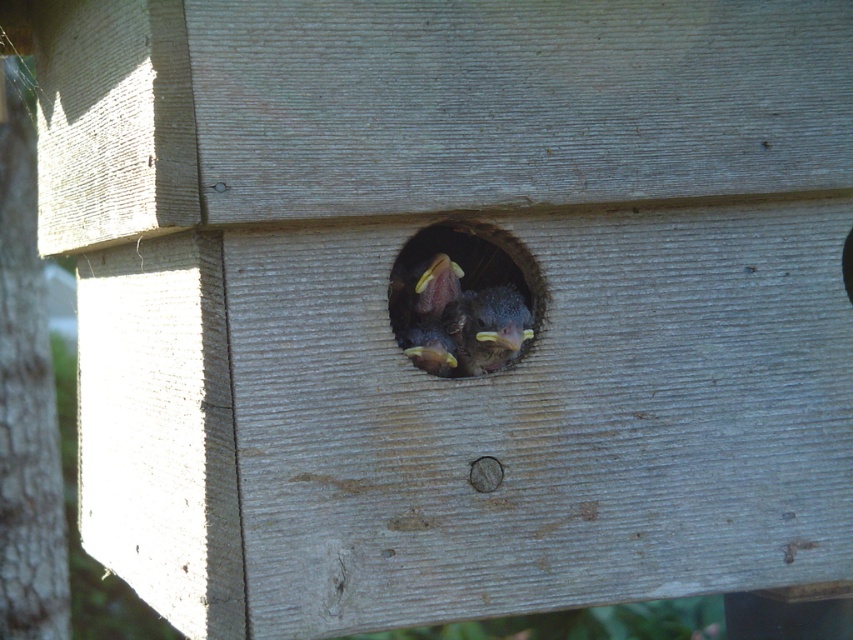
You are a bird trying to find the entrance to the smooth wood hole at center. Based on the scene, where would you look?

The entrance to the smooth wood hole at center is located at the 2D coordinates point (457, 301).

You are a bird trying to enter the smooth wood hole at center. You see the smooth brown bird at center inside the hole. Can you tell if the hole is wide enough for you to fit through?

The smooth wood hole at center might be wider than smooth brown bird at center, so there is a possibility that the hole is wide enough for you to fit through.